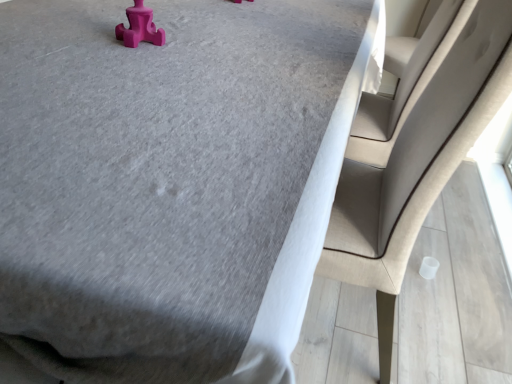
Where is `vacant area to the right of pink rubber toy at upper left`? vacant area to the right of pink rubber toy at upper left is located at coordinates (208, 49).